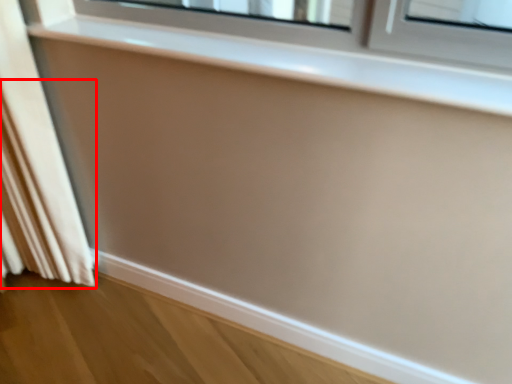
Question: From the image's perspective, considering the relative positions of curtain (annotated by the red box) and window sill in the image provided, where is curtain (annotated by the red box) located with respect to the staircase?

Choices:
 (A) below
 (B) above

Answer: (A)